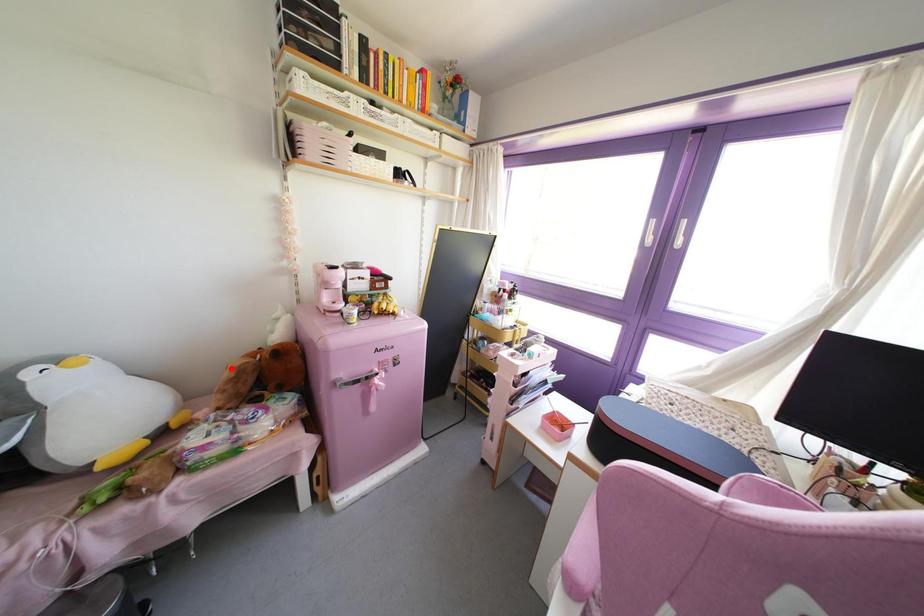
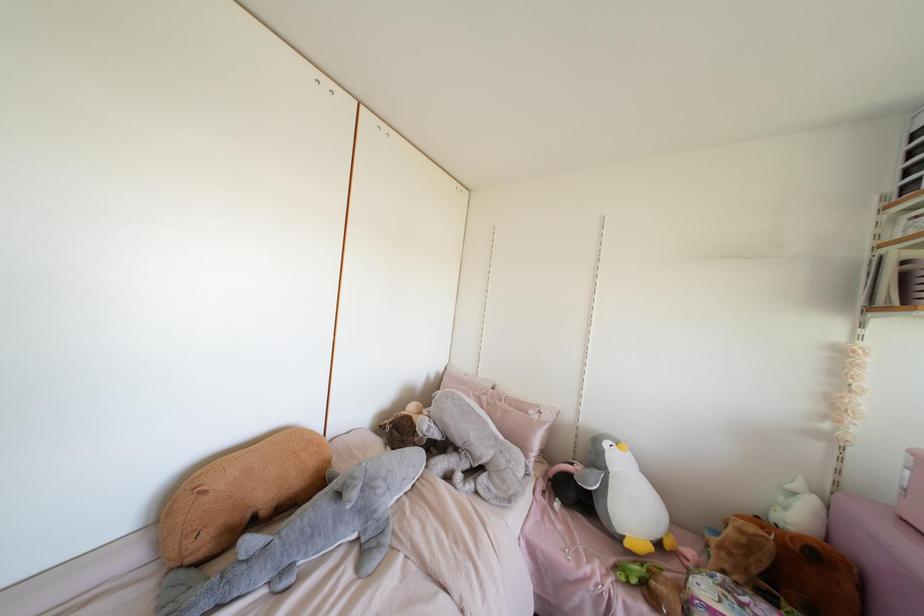
In the second image, find the point that corresponds to the highlighted location in the first image.

(739, 531)